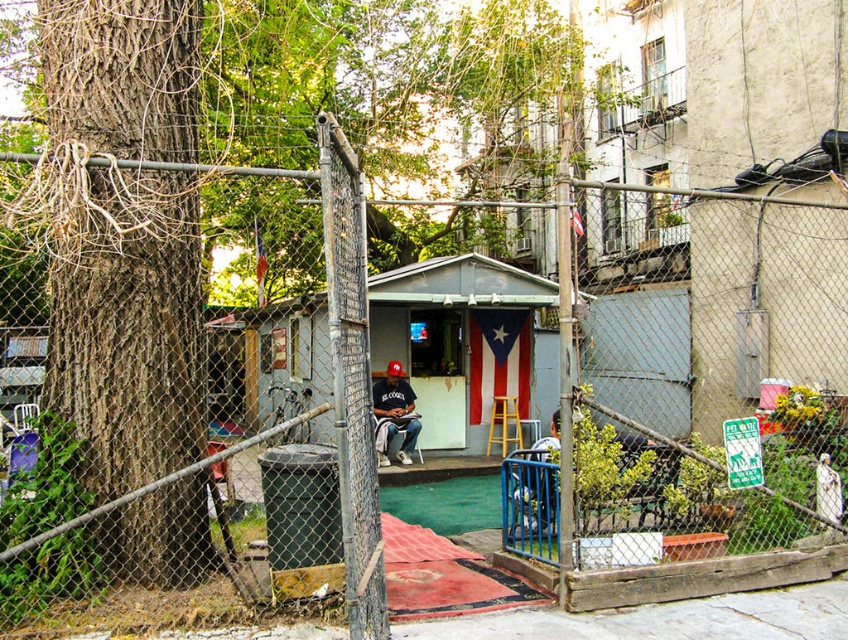
Question: In this image, where is matte black shirt at center located relative to yellow wood stool at center?

Choices:
 (A) left
 (B) right

Answer: (A)

Question: Estimate the real-world distances between objects in this image. Which object is farther from the matte black cap at center?

Choices:
 (A) yellow wood stool at center
 (B) brown rough bark tree at left
 (C) matte black shirt at center

Answer: (B)

Question: Does brown rough bark tree at left lie in front of yellow wood stool at center?

Choices:
 (A) yes
 (B) no

Answer: (A)

Question: Can you confirm if matte black shirt at center is smaller than yellow wood stool at center?

Choices:
 (A) no
 (B) yes

Answer: (A)

Question: Which point is closer to the camera?

Choices:
 (A) brown rough bark tree at left
 (B) matte black shirt at center
 (C) yellow wood stool at center
 (D) matte black cap at center

Answer: (A)

Question: Which of the following is the closest to the observer?

Choices:
 (A) (409, 422)
 (B) (495, 403)
 (C) (553, 499)
 (D) (199, 568)

Answer: (D)